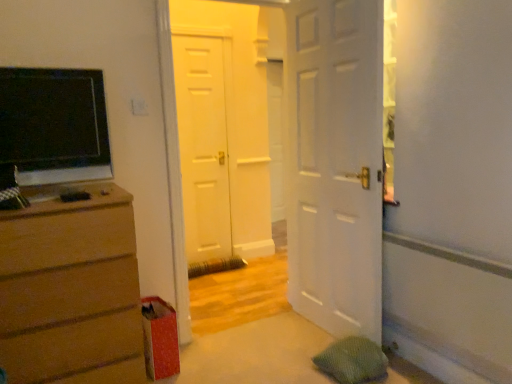
Question: From a real-world perspective, is white matte door at center, the 2th door from the front, positioned under matte brown dresser at left based on gravity?

Choices:
 (A) yes
 (B) no

Answer: (B)

Question: Is white matte door at center, the 2th door from the front, at the right side of matte brown dresser at left?

Choices:
 (A) no
 (B) yes

Answer: (B)

Question: Considering the relative sizes of white matte door at center, the 2th door from the front, and matte brown dresser at left in the image provided, is white matte door at center, the 2th door from the front, wider than matte brown dresser at left?

Choices:
 (A) no
 (B) yes

Answer: (A)

Question: Is there a large distance between white matte door at center, the 2th door from the front, and matte brown dresser at left?

Choices:
 (A) no
 (B) yes

Answer: (B)

Question: Is white matte door at center, the 2th door from the front, positioned with its back to matte brown dresser at left?

Choices:
 (A) no
 (B) yes

Answer: (A)

Question: In the image, is white matte door at center, the 2th door from the front, on the left side or the right side of white matte door at center, the 1th door in the back-to-front sequence?

Choices:
 (A) left
 (B) right

Answer: (B)

Question: From the image's perspective, is white matte door at center, the 2th door from the front, located above or below white matte door at center, the 1th door in the back-to-front sequence?

Choices:
 (A) above
 (B) below

Answer: (B)

Question: Is point (185, 223) positioned closer to the camera than point (193, 162)?

Choices:
 (A) farther
 (B) closer

Answer: (A)

Question: Is white matte door at center, the 2th door from the front, taller or shorter than white matte door at center, placed as the third door when sorted from front to back?

Choices:
 (A) short
 (B) tall

Answer: (B)

Question: Is point (225, 226) closer or farther from the camera than point (305, 59)?

Choices:
 (A) farther
 (B) closer

Answer: (A)

Question: Is white matte door at center, placed as the third door when sorted from front to back, inside the boundaries of white matte door at center, the third door viewed from the back, or outside?

Choices:
 (A) inside
 (B) outside

Answer: (B)

Question: Is white matte door at center, placed as the third door when sorted from front to back, wider or thinner than white matte door at center, the third door viewed from the back?

Choices:
 (A) wide
 (B) thin

Answer: (B)

Question: Based on their sizes in the image, would you say white matte door at center, the 1th door in the back-to-front sequence, is bigger or smaller than white matte door at center, the third door viewed from the back?

Choices:
 (A) big
 (B) small

Answer: (B)

Question: Do you think white matte door at center, placed as the third door when sorted from front to back, is within white matte door at center, the 2th door positioned from the back, or outside of it?

Choices:
 (A) inside
 (B) outside

Answer: (B)

Question: From their relative heights in the image, would you say white matte door at center, placed as the third door when sorted from front to back, is taller or shorter than white matte door at center, the 2th door positioned from the back?

Choices:
 (A) tall
 (B) short

Answer: (B)